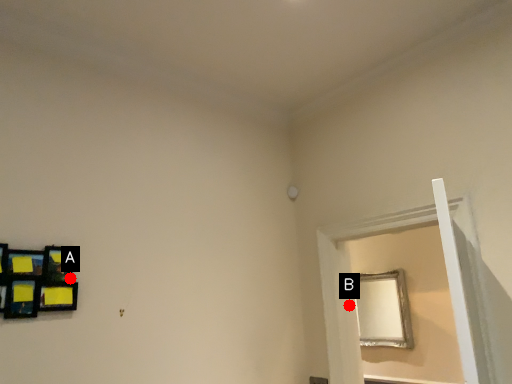
Question: Two points are circled on the image, labeled by A and B beside each circle. Which point is farther to the camera?

Choices:
 (A) A is further
 (B) B is further

Answer: (B)